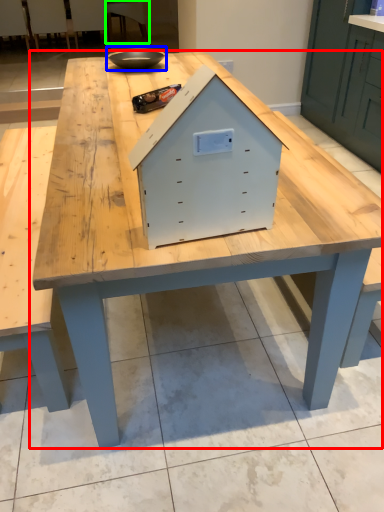
Question: Which object is the closest to the table (highlighted by a red box)? Choose among these: bowl (highlighted by a blue box) or chair (highlighted by a green box).

Choices:
 (A) bowl
 (B) chair

Answer: (A)